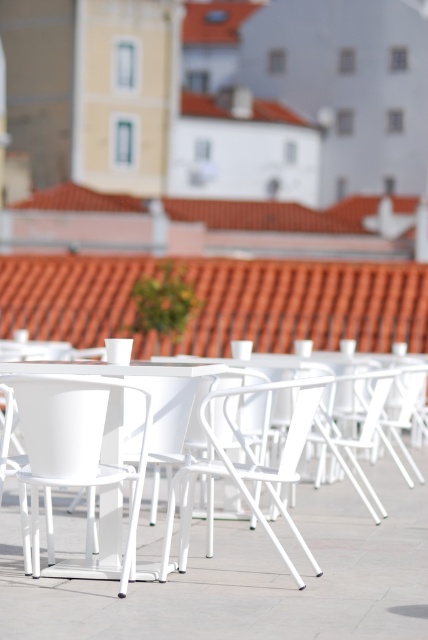
Can you confirm if white plastic table at center is positioned below white metal chair at center?

Correct, white plastic table at center is located below white metal chair at center.

Is point (109, 508) behind point (119, 540)?

Yes, it is behind point (119, 540).

Image resolution: width=428 pixels, height=640 pixels. Identify the location of white plastic table at center. (115, 368).

Does white metal/fabric folding chair at center appear under white plastic table at center?

Indeed, white metal/fabric folding chair at center is positioned under white plastic table at center.

Does white metal/fabric folding chair at center appear over white plastic table at center?

No, white metal/fabric folding chair at center is not above white plastic table at center.

Who is more forward, (311, 394) or (79, 372)?

Positioned in front is point (79, 372).

What are the coordinates of `white metal/fabric folding chair at center` in the screenshot? It's located at (247, 467).

Identify the location of white metal/fabric folding chair at center. The height and width of the screenshot is (640, 428). (247, 467).

Can you confirm if white metal/fabric folding chair at center is positioned to the left of white metal chair at center?

Incorrect, white metal/fabric folding chair at center is not on the left side of white metal chair at center.

The image size is (428, 640). In order to click on white metal/fabric folding chair at center in this screenshot , I will do `click(247, 467)`.

This screenshot has width=428, height=640. What are the coordinates of `white metal/fabric folding chair at center` in the screenshot? It's located at (247, 467).